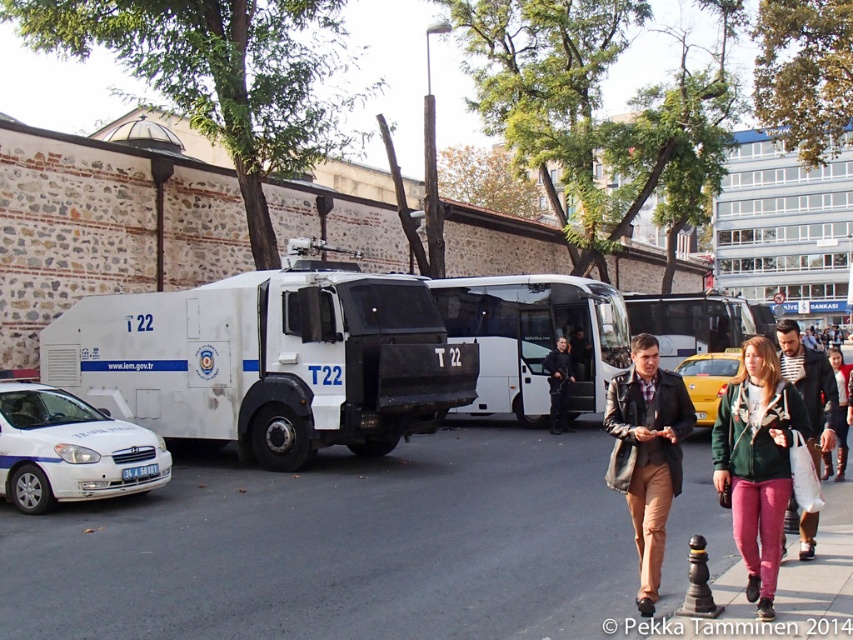
Measure the distance between point (264,483) and camera.

The distance of point (264,483) from camera is 10.85 meters.

Between point (32, 579) and point (120, 452), which one is positioned behind?

The point (120, 452) is behind.

This screenshot has height=640, width=853. In order to click on gray asphalt pavement at center in this screenshot , I will do `click(338, 547)`.

Identify the location of gray asphalt pavement at center. The width and height of the screenshot is (853, 640). (338, 547).

Is point (776, 481) positioned in front of point (560, 368)?

Yes.

At what (x,y) coordinates should I click in order to perform the action: click on green fleece jacket at center. Please return your answer as a coordinate pair (x, y). Looking at the image, I should click on (757, 461).

From the picture: Can you confirm if leather jacket at center is wider than white plastic tour bus at center?

In fact, leather jacket at center might be narrower than white plastic tour bus at center.

At what (x,y) coordinates should I click in order to perform the action: click on leather jacket at center. Please return your answer as a coordinate pair (x, y). Looking at the image, I should click on (647, 452).

This screenshot has width=853, height=640. Identify the location of leather jacket at center. (647, 452).